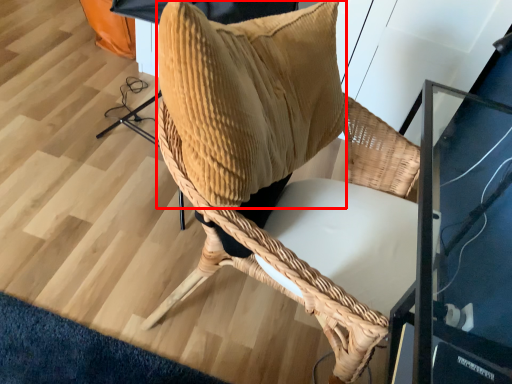
Question: From the image's perspective, what is the correct spatial positioning of pillow (annotated by the red box) in reference to chair?

Choices:
 (A) above
 (B) below

Answer: (A)